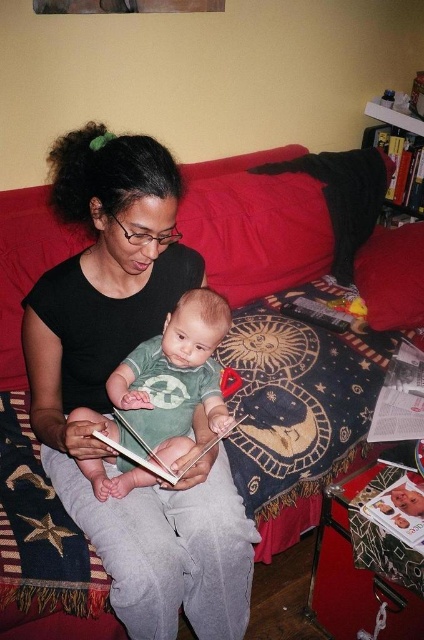
Can you confirm if black matte shirt at center is bigger than green cotton shirt at center?

Yes, black matte shirt at center is bigger than green cotton shirt at center.

Measure the distance between black matte shirt at center and green cotton shirt at center.

They are 4.28 inches apart.

Is point (134, 577) positioned before point (125, 396)?

That is True.

Find the location of a particular element. The image size is (424, 640). black matte shirt at center is located at coordinates (108, 401).

Which is more to the left, green cotton shirt at center or matte paper book at lower right?

green cotton shirt at center is more to the left.

Which of these two, green cotton shirt at center or matte paper book at lower right, stands shorter?

With less height is matte paper book at lower right.

Image resolution: width=424 pixels, height=640 pixels. I want to click on green cotton shirt at center, so click(x=175, y=376).

Where is `green cotton shirt at center`? green cotton shirt at center is located at coordinates (175, 376).

Between black matte shirt at center and matte paper book at lower right, which one appears on the right side from the viewer's perspective?

Positioned to the right is matte paper book at lower right.

Who is more distant from viewer, [133,326] or [404,518]?

The point [133,326] is more distant.

Is point (49, 332) more distant than point (410, 540)?

Yes, point (49, 332) is behind point (410, 540).

Locate an element on the screen. Image resolution: width=424 pixels, height=640 pixels. black matte shirt at center is located at coordinates (108, 401).